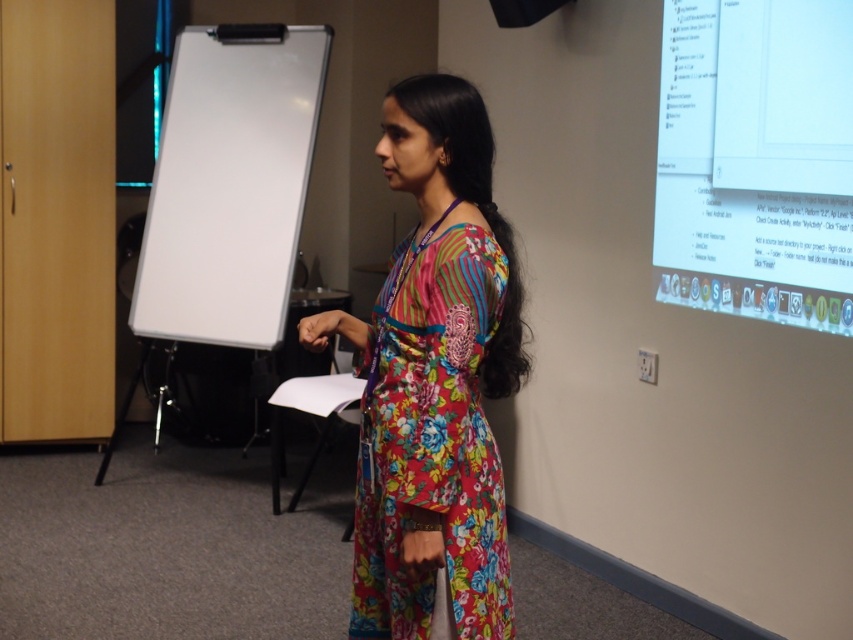
Question: Observing the image, what is the correct spatial positioning of floral fabric dress at center in reference to white glossy screen at upper right?

Choices:
 (A) above
 (B) below

Answer: (B)

Question: Is floral fabric dress at center further to camera compared to white matte board at left?

Choices:
 (A) yes
 (B) no

Answer: (B)

Question: Among these objects, which one is nearest to the camera?

Choices:
 (A) white glossy screen at upper right
 (B) white matte board at left

Answer: (A)

Question: Is floral fabric dress at center to the right of white glossy screen at upper right from the viewer's perspective?

Choices:
 (A) yes
 (B) no

Answer: (B)

Question: Which point appears farthest from the camera in this image?

Choices:
 (A) (401, 625)
 (B) (225, 164)
 (C) (786, 24)

Answer: (B)

Question: Which point is closer to the camera?

Choices:
 (A) white glossy screen at upper right
 (B) floral fabric dress at center
 (C) white matte board at left

Answer: (B)